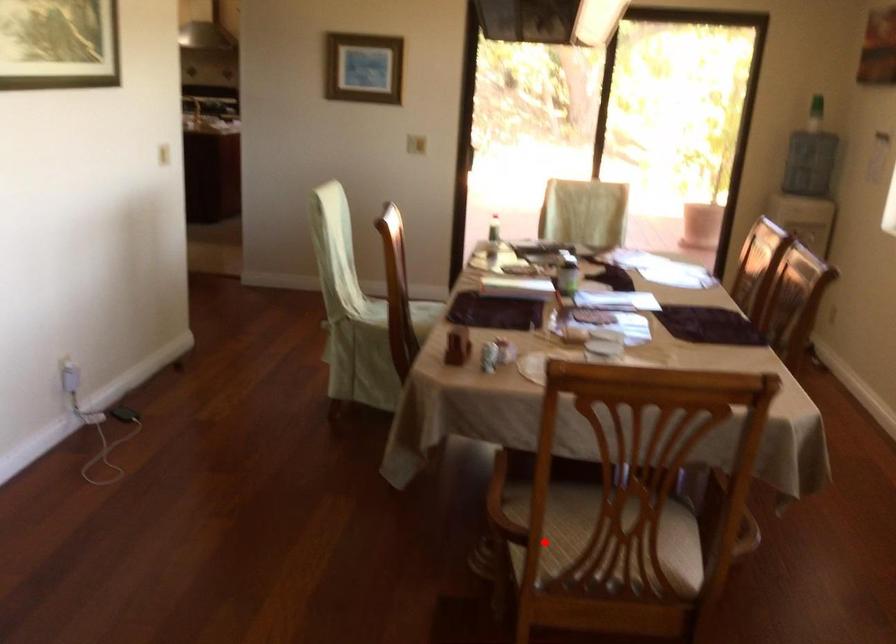
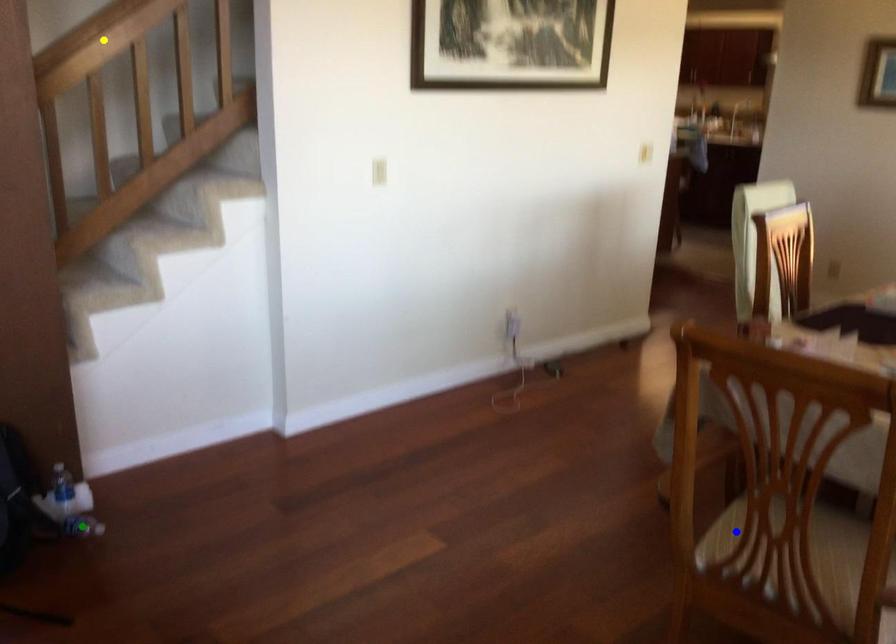
Question: I am providing you with two images of the same scene from different viewpoints. A red point is marked on the first image. You are given multiple points on the second image. Which mark in image 2 goes with the point in image 1?

Choices:
 (A) blue point
 (B) green point
 (C) yellow point

Answer: (A)